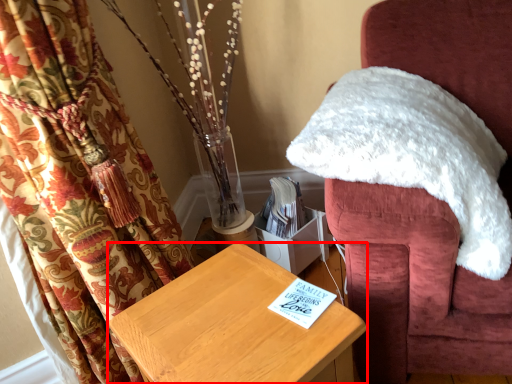
Question: Observing the image, what is the correct spatial positioning of furniture (annotated by the red box) in reference to chair?

Choices:
 (A) right
 (B) left

Answer: (B)